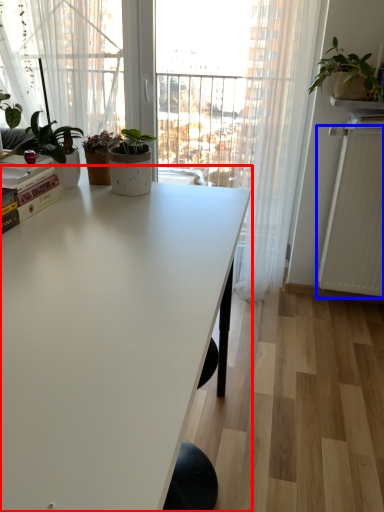
Question: Which object appears farthest to the camera in this image, table (highlighted by a red box) or radiator (highlighted by a blue box)?

Choices:
 (A) table
 (B) radiator

Answer: (B)